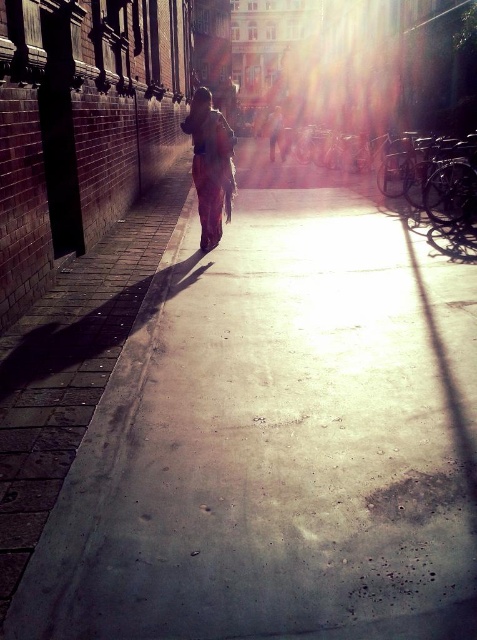
You are a fashion designer observing the street scene. You notice the matte orange pants at center and the light brown leather jacket at center. Which clothing item appears shorter in the scene?

The matte orange pants at center has a lesser height compared to the light brown leather jacket at center, so the matte orange pants at center appears shorter.

You are standing on the pathway and see the matte orange pants at center. Where exactly are they located in the image?

The matte orange pants at center are located at point coordinates of 0.259 on the x axis and 0.442 on the y axis.